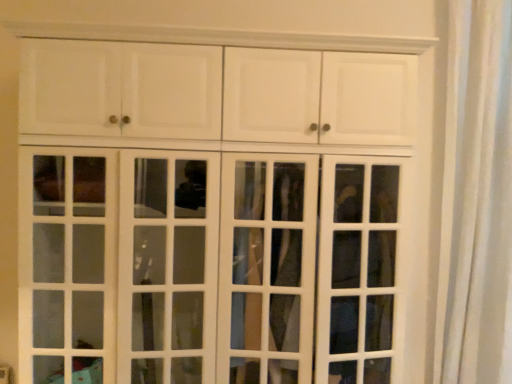
Describe the element at coordinates (476, 198) in the screenshot. I see `white textured curtain at right` at that location.

I want to click on white textured curtain at right, so click(x=476, y=198).

Locate an element on the screen. Image resolution: width=512 pixels, height=384 pixels. white textured curtain at right is located at coordinates (476, 198).